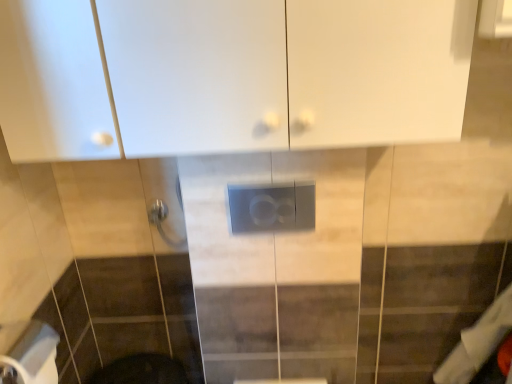
Question: From the image's perspective, is white glossy cabinet at upper center on white matte toilet paper at lower left?

Choices:
 (A) yes
 (B) no

Answer: (A)

Question: Is white glossy cabinet at upper center with white matte toilet paper at lower left?

Choices:
 (A) yes
 (B) no

Answer: (B)

Question: Can you confirm if white glossy cabinet at upper center is shorter than white matte toilet paper at lower left?

Choices:
 (A) yes
 (B) no

Answer: (B)

Question: From a real-world perspective, is white glossy cabinet at upper center located beneath white matte toilet paper at lower left?

Choices:
 (A) no
 (B) yes

Answer: (A)

Question: Considering the relative positions of white glossy cabinet at upper center and white matte toilet paper at lower left in the image provided, is white glossy cabinet at upper center to the right of white matte toilet paper at lower left from the viewer's perspective?

Choices:
 (A) no
 (B) yes

Answer: (B)

Question: Looking at their shapes, would you say white matte toilet paper at lower left is wider or thinner than satin gray panel at center?

Choices:
 (A) wide
 (B) thin

Answer: (A)

Question: Is white matte toilet paper at lower left situated inside satin gray panel at center or outside?

Choices:
 (A) outside
 (B) inside

Answer: (A)

Question: From a real-world perspective, is white matte toilet paper at lower left positioned above or below satin gray panel at center?

Choices:
 (A) above
 (B) below

Answer: (B)

Question: Is white matte toilet paper at lower left bigger or smaller than satin gray panel at center?

Choices:
 (A) big
 (B) small

Answer: (A)

Question: Considering the relative positions of white glossy cabinet at upper center and satin gray panel at center in the image provided, is white glossy cabinet at upper center to the left or to the right of satin gray panel at center?

Choices:
 (A) right
 (B) left

Answer: (B)

Question: Considering the positions of point (461, 39) and point (304, 221), is point (461, 39) closer or farther from the camera than point (304, 221)?

Choices:
 (A) farther
 (B) closer

Answer: (B)

Question: Is white glossy cabinet at upper center bigger or smaller than satin gray panel at center?

Choices:
 (A) small
 (B) big

Answer: (B)

Question: Relative to satin gray panel at center, is white glossy cabinet at upper center in front or behind?

Choices:
 (A) behind
 (B) front

Answer: (B)

Question: From a real-world perspective, is satin gray panel at center physically located above or below white glossy cabinet at upper center?

Choices:
 (A) above
 (B) below

Answer: (B)

Question: Considering the positions of satin gray panel at center and white glossy cabinet at upper center in the image, is satin gray panel at center bigger or smaller than white glossy cabinet at upper center?

Choices:
 (A) small
 (B) big

Answer: (A)